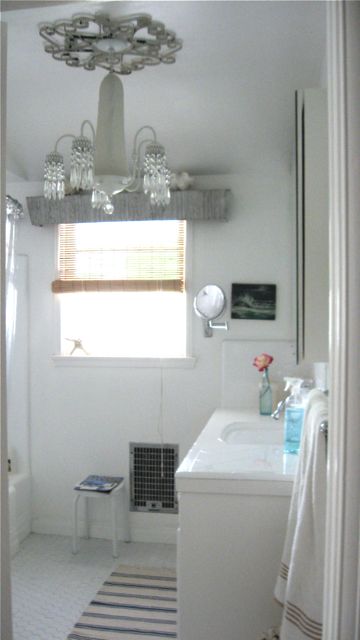
The image size is (360, 640). What are the coordinates of `sink` in the screenshot? It's located at (233, 438).